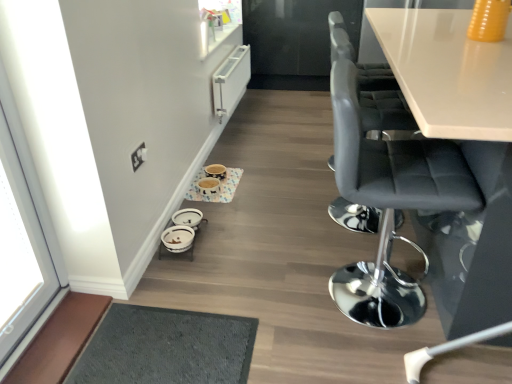
Find the location of a particular element. vacant space to the right of white glass window at left is located at coordinates (100, 334).